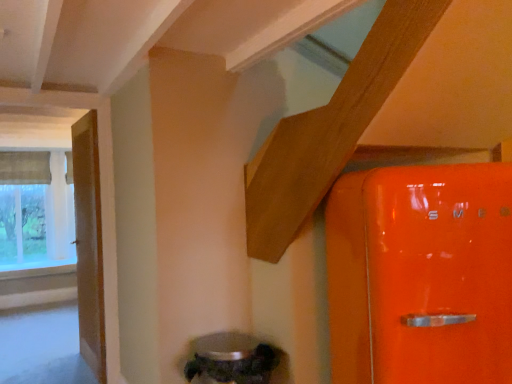
Question: Can wooden door at left be found inside metallic silver water heater at lower center?

Choices:
 (A) no
 (B) yes

Answer: (A)

Question: Is metallic silver water heater at lower center to the right of wooden door at left from the viewer's perspective?

Choices:
 (A) yes
 (B) no

Answer: (A)

Question: Considering the relative sizes of metallic silver water heater at lower center and wooden door at left in the image provided, is metallic silver water heater at lower center bigger than wooden door at left?

Choices:
 (A) no
 (B) yes

Answer: (A)

Question: Can you confirm if metallic silver water heater at lower center is taller than wooden door at left?

Choices:
 (A) no
 (B) yes

Answer: (A)

Question: From the image's perspective, does metallic silver water heater at lower center appear higher than wooden door at left?

Choices:
 (A) yes
 (B) no

Answer: (B)

Question: Considering the relative positions of textured fabric window at left and metallic silver water heater at lower center in the image provided, is textured fabric window at left to the left or to the right of metallic silver water heater at lower center?

Choices:
 (A) left
 (B) right

Answer: (A)

Question: Looking at the image, does textured fabric window at left seem bigger or smaller compared to metallic silver water heater at lower center?

Choices:
 (A) big
 (B) small

Answer: (A)

Question: In terms of height, does textured fabric window at left look taller or shorter compared to metallic silver water heater at lower center?

Choices:
 (A) tall
 (B) short

Answer: (A)

Question: Is point (12, 241) positioned closer to the camera than point (208, 342)?

Choices:
 (A) closer
 (B) farther

Answer: (B)

Question: Looking at their shapes, would you say clear glass window sill at lower left is wider or thinner than wooden door at left?

Choices:
 (A) wide
 (B) thin

Answer: (A)

Question: Would you say clear glass window sill at lower left is to the left or to the right of wooden door at left in the picture?

Choices:
 (A) left
 (B) right

Answer: (A)

Question: Is clear glass window sill at lower left bigger or smaller than wooden door at left?

Choices:
 (A) small
 (B) big

Answer: (A)

Question: From the image's perspective, is clear glass window sill at lower left above or below wooden door at left?

Choices:
 (A) above
 (B) below

Answer: (B)

Question: In terms of size, does textured fabric window at left appear bigger or smaller than wooden door at left?

Choices:
 (A) small
 (B) big

Answer: (B)

Question: Is point (24, 243) closer or farther from the camera than point (78, 233)?

Choices:
 (A) closer
 (B) farther

Answer: (B)